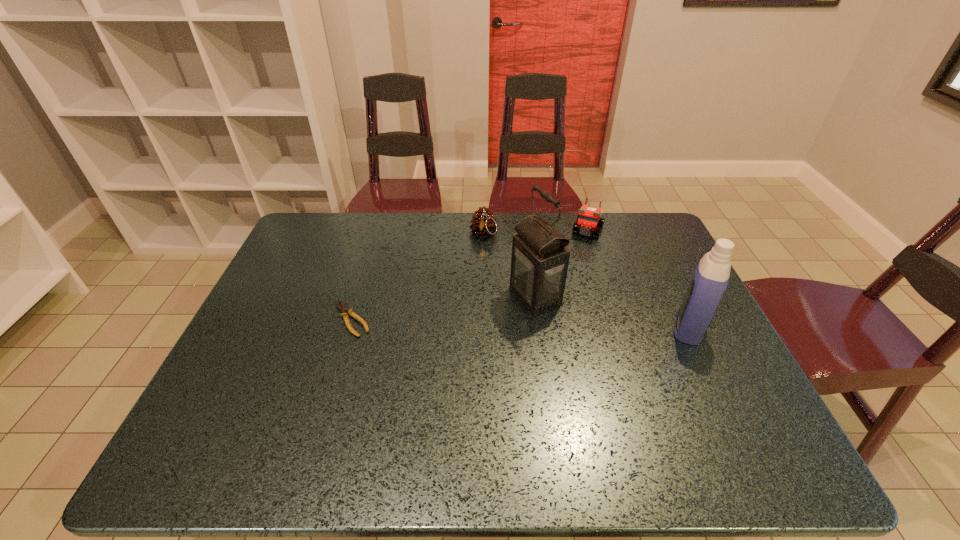
I want to click on free location located 0.220m on the front-facing side of the Lego, so click(x=567, y=281).

The image size is (960, 540). What are the coordinates of `vacant space situated 0.070m on the front-facing side of the Lego` in the screenshot? It's located at (579, 252).

I want to click on free space located 0.070m on the front-facing side of the Lego, so [x=579, y=252].

Locate an element on the screen. The height and width of the screenshot is (540, 960). vacant point located on the front-facing side of the tallest object is located at coordinates (488, 316).

Where is `vacant space positioned 0.280m on the front-facing side of the tallest object`? Image resolution: width=960 pixels, height=540 pixels. vacant space positioned 0.280m on the front-facing side of the tallest object is located at coordinates (420, 342).

The image size is (960, 540). In order to click on vacant space located on the front-facing side of the tallest object in this screenshot , I will do `click(458, 327)`.

The width and height of the screenshot is (960, 540). I want to click on vacant point located 0.150m with a leaf charm attached to the pinecone, so click(484, 274).

The image size is (960, 540). I want to click on free space located 0.220m with a leaf charm attached to the pinecone, so click(485, 290).

Image resolution: width=960 pixels, height=540 pixels. I want to click on vacant area situated 0.130m with a leaf charm attached to the pinecone, so click(484, 270).

Identify the location of Lego located in the far edge section of the desktop. The image size is (960, 540). (588, 221).